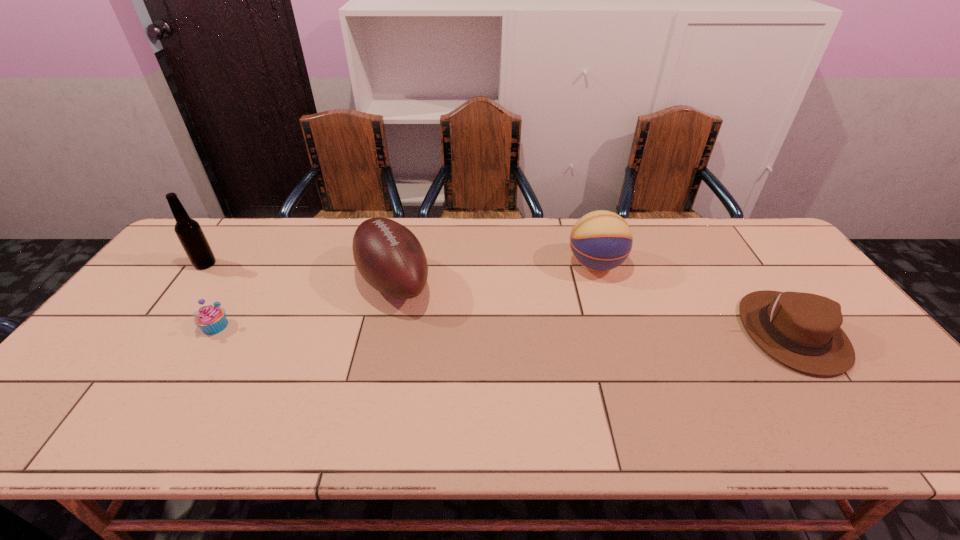
The width and height of the screenshot is (960, 540). What are the coordinates of `object that is at the far left corner` in the screenshot? It's located at (191, 236).

Identify the location of vacant space at the far edge. (465, 245).

You are a GUI agent. You are given a task and a screenshot of the screen. Output one action in this format:
    pyautogui.click(x=<x>, y=<y>)
    Task: Click on the vacant space at the near edge
    This screenshot has height=540, width=960.
    Given the screenshot: What is the action you would take?
    pyautogui.click(x=516, y=444)

This screenshot has height=540, width=960. I want to click on free spot at the left edge of the desktop, so click(173, 282).

Identify the location of vacant area at the far left corner. (222, 221).

Locate an element on the screen. vacant space at the near left corner of the desktop is located at coordinates (34, 417).

In the image, there is a desktop. Identify the location of blank space at the far right corner. (756, 219).

Image resolution: width=960 pixels, height=540 pixels. I want to click on free point between the leftmost object and the fourth object from right to left, so click(210, 295).

At what (x,y) coordinates should I click in order to perform the action: click on free space between the beer bottle and the football (American). Please return your answer as a coordinate pair (x, y). The image size is (960, 540). Looking at the image, I should click on (300, 273).

Find the location of a particular element. vacant space that's between the fourth tallest object and the third object from right to left is located at coordinates (593, 307).